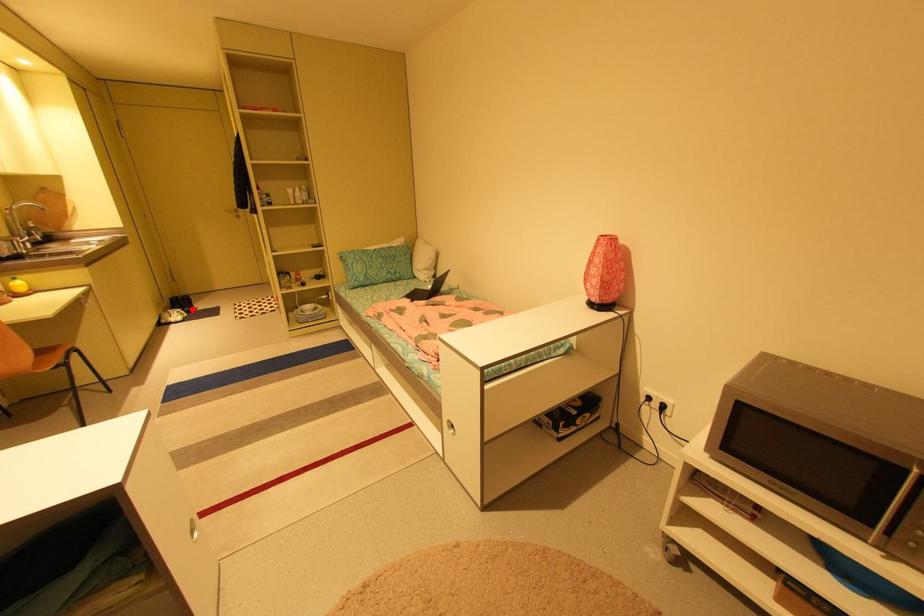
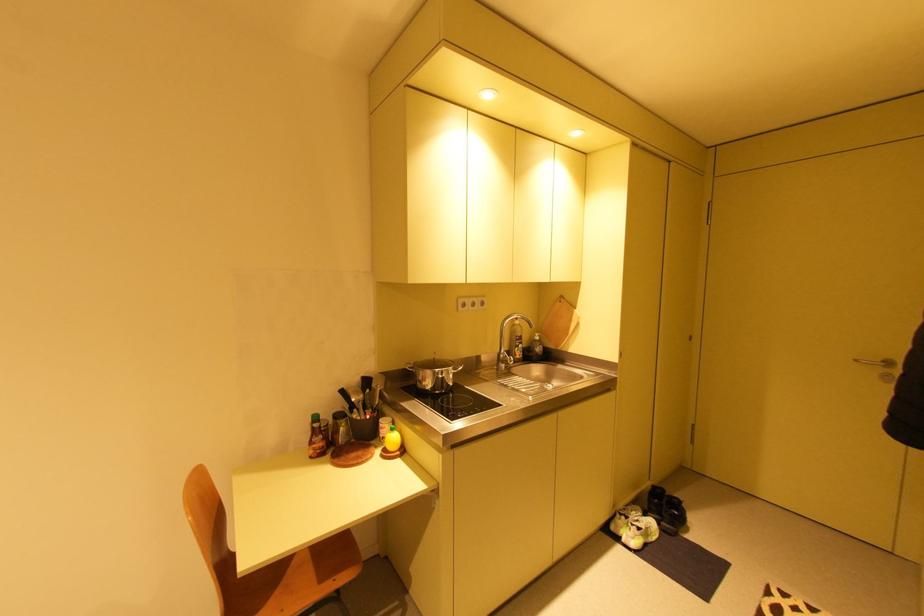
Where in the second image is the point corresponding to the highlighted location from the first image?

(670, 524)